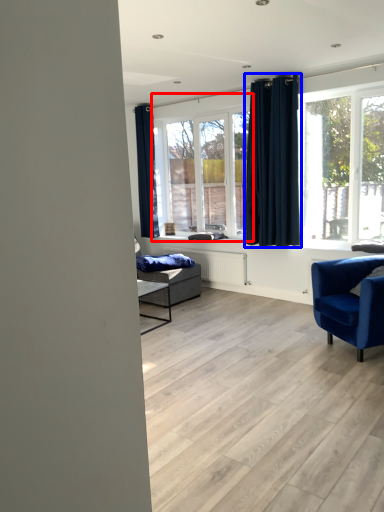
Question: Which object is closer to the camera taking this photo, window (highlighted by a red box) or curtain (highlighted by a blue box)?

Choices:
 (A) window
 (B) curtain

Answer: (B)